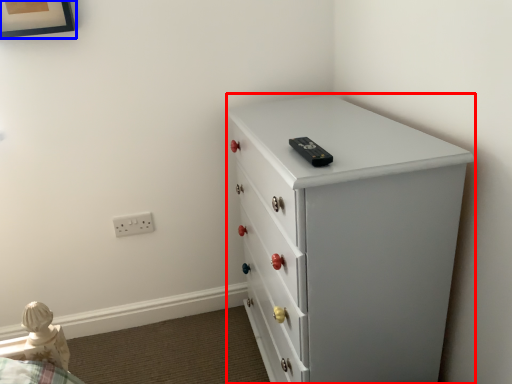
Question: Which of the following is the closest to the observer, chest of drawers (highlighted by a red box) or picture frame (highlighted by a blue box)?

Choices:
 (A) chest of drawers
 (B) picture frame

Answer: (A)